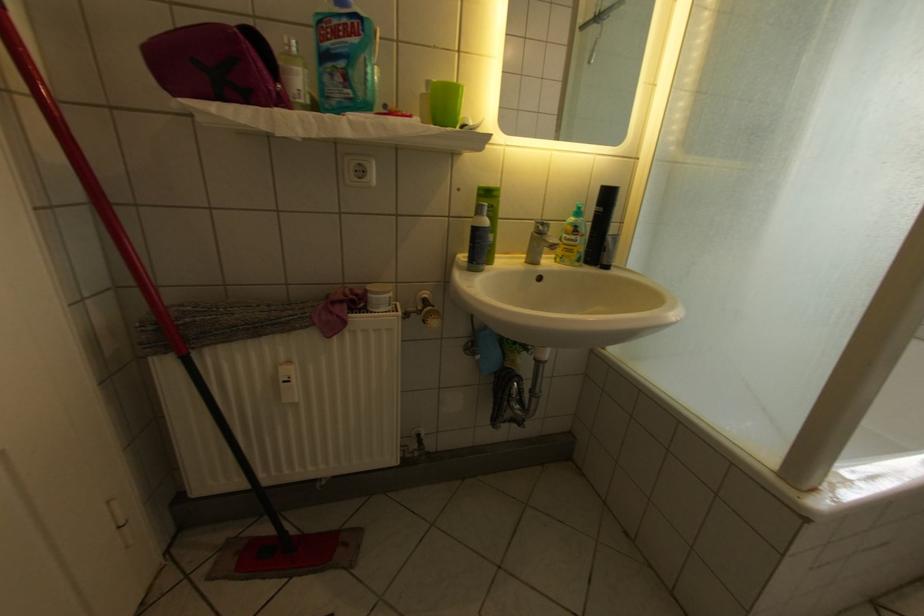
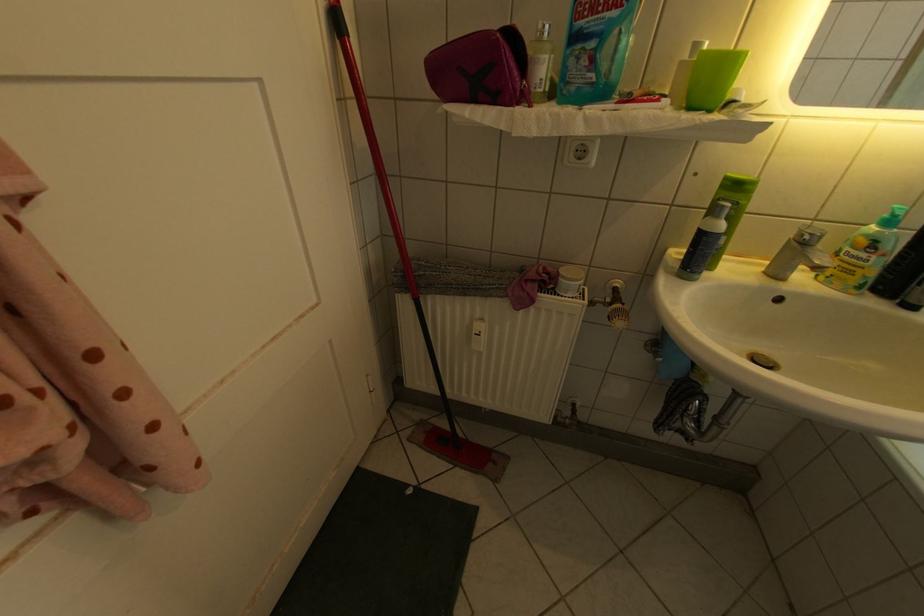
In the second image, find the point that corresponds to (590,238) in the first image.

(888, 257)